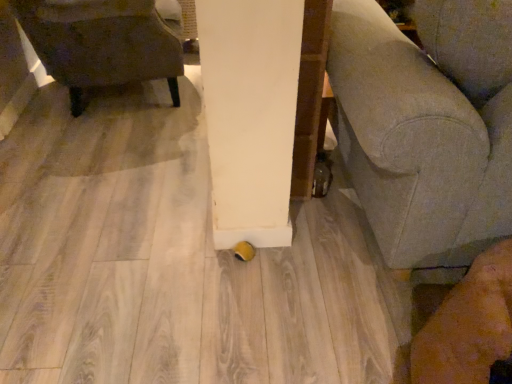
Question: Does dark brown leather chair at left have a smaller size compared to gray fabric couch at lower right?

Choices:
 (A) yes
 (B) no

Answer: (A)

Question: Can you confirm if dark brown leather chair at left is shorter than gray fabric couch at lower right?

Choices:
 (A) no
 (B) yes

Answer: (B)

Question: From a real-world perspective, is dark brown leather chair at left over gray fabric couch at lower right?

Choices:
 (A) yes
 (B) no

Answer: (B)

Question: Does dark brown leather chair at left have a larger size compared to gray fabric couch at lower right?

Choices:
 (A) no
 (B) yes

Answer: (A)

Question: Is dark brown leather chair at left not near gray fabric couch at lower right?

Choices:
 (A) yes
 (B) no

Answer: (A)

Question: Can you see dark brown leather chair at left touching gray fabric couch at lower right?

Choices:
 (A) no
 (B) yes

Answer: (A)

Question: From a real-world perspective, is gray fabric couch at lower right over dark brown leather chair at left?

Choices:
 (A) no
 (B) yes

Answer: (B)

Question: Does gray fabric couch at lower right lie behind dark brown leather chair at left?

Choices:
 (A) no
 (B) yes

Answer: (A)

Question: Does gray fabric couch at lower right have a larger size compared to dark brown leather chair at left?

Choices:
 (A) no
 (B) yes

Answer: (B)

Question: Can you confirm if gray fabric couch at lower right is thinner than dark brown leather chair at left?

Choices:
 (A) no
 (B) yes

Answer: (A)

Question: Considering the relative positions of gray fabric couch at lower right and dark brown leather chair at left in the image provided, is gray fabric couch at lower right to the right of dark brown leather chair at left from the viewer's perspective?

Choices:
 (A) no
 (B) yes

Answer: (B)

Question: Does gray fabric couch at lower right touch dark brown leather chair at left?

Choices:
 (A) no
 (B) yes

Answer: (A)

Question: From the image's perspective, relative to gray fabric couch at lower right, is dark brown leather chair at left above or below?

Choices:
 (A) below
 (B) above

Answer: (B)